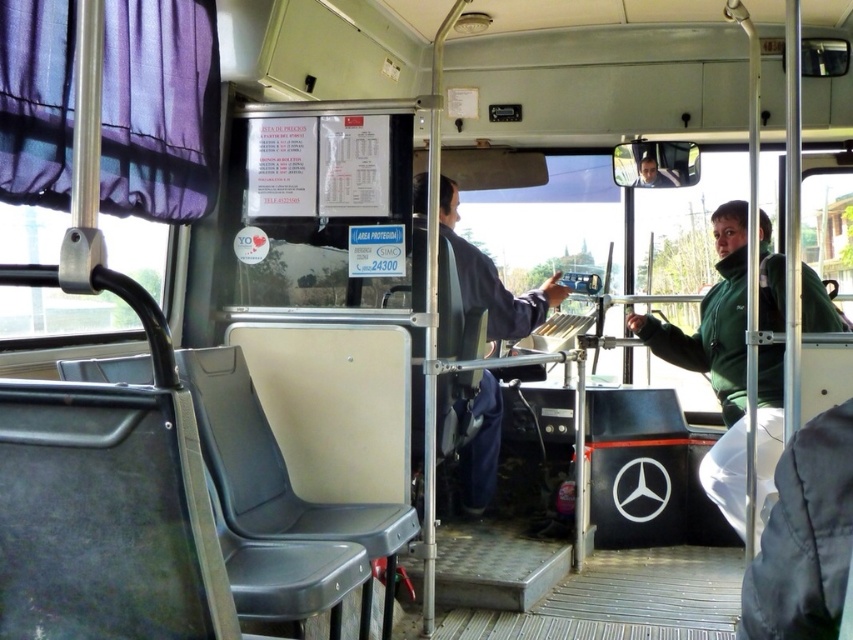
You are a bus passenger trying to sit down. You see a green matte jacket at right and a dark blue fabric jacket at center. Which jacket is taking up more space in the seating area?

The green matte jacket at right might be wider than dark blue fabric jacket at center, so it is possibly taking up more space in the seating area.

You are a passenger on the bus and need to choose between placing your bag on the green matte jacket at right or the dark blue fabric jacket at center. Which jacket can accommodate a larger bag?

The dark blue fabric jacket at center can accommodate a larger bag since it has a bigger size compared to the green matte jacket at right.